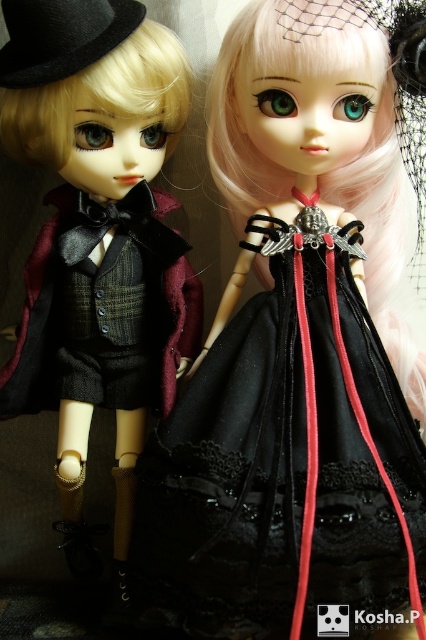
You are a fashion designer analyzing the positioning of two accessories in the image. The accessories are the matte black dress at center and the black felt hat at upper left. Which accessory is located to the right of the other?

The matte black dress at center is positioned on the right side of black felt hat at upper left.

From the picture: You are a fashion designer who needs to determine the spatial relationship between the matte black dress at center and the black felt hat at upper left. Which object is wider?

The matte black dress at center is wider than the black felt hat at upper left.